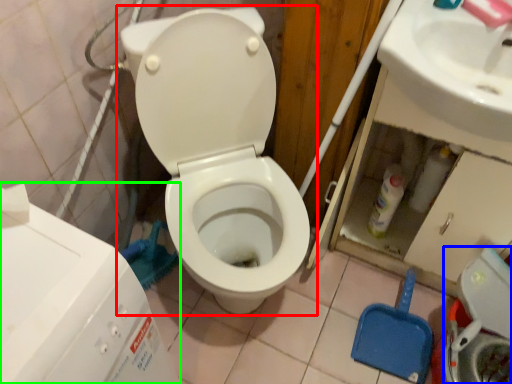
Question: Considering the real-world distances, which object is closest to toilet (highlighted by a red box)? washer (highlighted by a blue box) or water tank (highlighted by a green box).

Choices:
 (A) washer
 (B) water tank

Answer: (B)